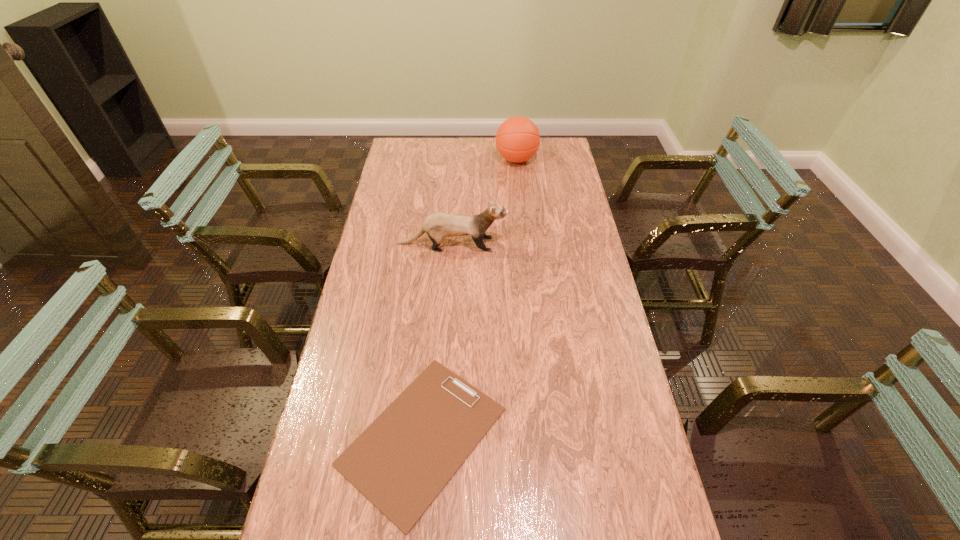
This screenshot has width=960, height=540. What are the coordinates of `object present at the right edge` in the screenshot? It's located at (517, 140).

Identify the location of object that is at the far right corner. (517, 140).

Identify the location of free spot at the far edge of the desktop. Image resolution: width=960 pixels, height=540 pixels. (456, 146).

The width and height of the screenshot is (960, 540). In order to click on vacant space at the left edge of the desktop in this screenshot , I will do `click(380, 287)`.

The width and height of the screenshot is (960, 540). In the image, there is a desktop. In order to click on blank space at the right edge in this screenshot , I will do `click(620, 426)`.

Locate an element on the screen. This screenshot has width=960, height=540. vacant space that's between the clipboard and the ferret is located at coordinates (438, 340).

This screenshot has width=960, height=540. In order to click on empty location between the ferret and the nearest object in this screenshot , I will do `click(438, 340)`.

Image resolution: width=960 pixels, height=540 pixels. I want to click on free spot between the clipboard and the second farthest object, so click(438, 340).

This screenshot has width=960, height=540. Find the location of `vacant area that lies between the ferret and the shortest object`. vacant area that lies between the ferret and the shortest object is located at coordinates (438, 340).

Find the location of `blank region between the ferret and the basketball`. blank region between the ferret and the basketball is located at coordinates (485, 202).